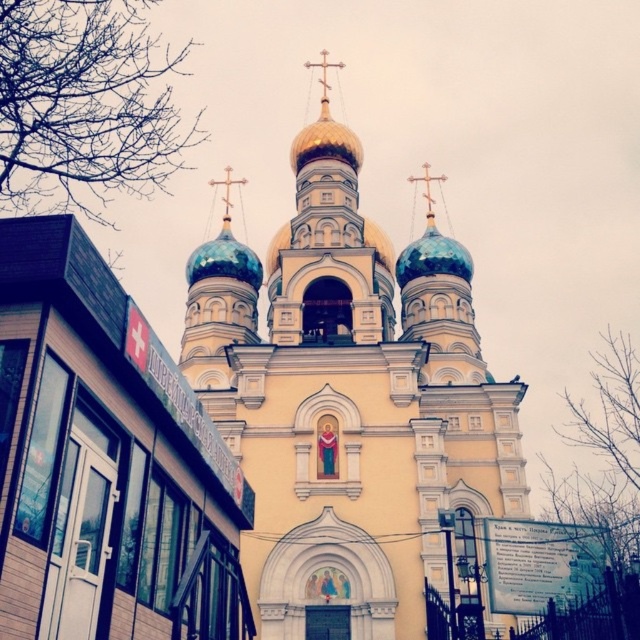
You are a drone operator tasked with capturing aerial footage of the church. You need to fly your drone between the blue glossy dome at center and the blue glossy dome at upper center to get a shot of the space between them. The drone has a wingspan of 2 meters. Is there enough space for the drone to pass through between the two domes?

The distance between the blue glossy dome at center and the blue glossy dome at upper center is 28.56 meters, which is significantly larger than the drone wingspan of 2 meters. Therefore, the drone has ample space to pass through between the two domes.

You are standing in front of the church and notice two points on the domes. The first point is at coordinate point (428, 394) and the second is at point (465, 278). Which point is closer to your eyes?

Point (428, 394) is closer to the camera than point (465, 278).

Based on the scene description, what color is the dome located at point coordinates (225,260)?

The dome at point coordinates (225,260) is blue glossy.